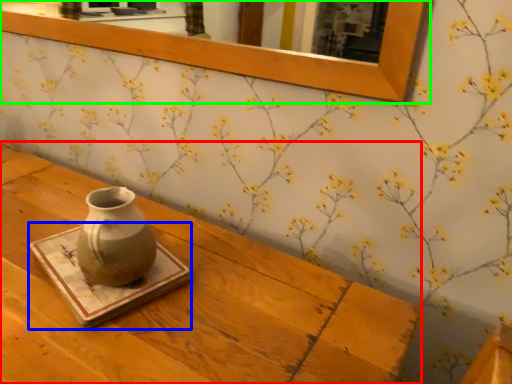
Question: Which object is the closest to the table (highlighted by a red box)? Choose among these: tray (highlighted by a blue box) or picture frame (highlighted by a green box).

Choices:
 (A) tray
 (B) picture frame

Answer: (A)